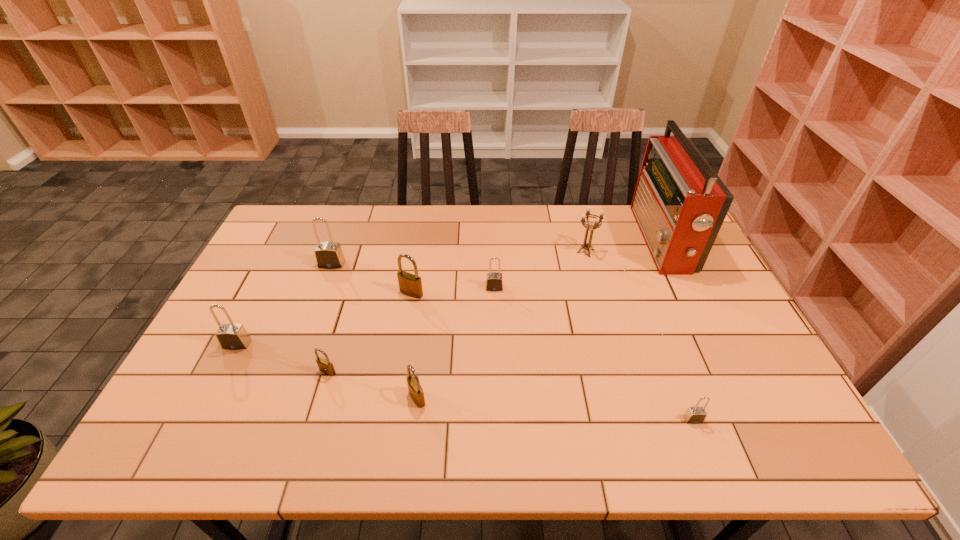
Locate an element on the screen. The width and height of the screenshot is (960, 540). vacant space located 0.230m on the right of the third object from right to left is located at coordinates (666, 251).

This screenshot has height=540, width=960. What are the coordinates of `vacant point located on the right of the biggest brass padlock` in the screenshot? It's located at click(x=467, y=293).

This screenshot has width=960, height=540. Find the location of `free spot located 0.160m on the shackle of the sixth farthest object`. free spot located 0.160m on the shackle of the sixth farthest object is located at coordinates (206, 404).

The image size is (960, 540). In order to click on vacant space located 0.190m on the shackle of the third biggest gray padlock in this screenshot , I will do `click(496, 341)`.

This screenshot has width=960, height=540. Find the location of `vacant region located 0.310m on the left of the nearest brass padlock`. vacant region located 0.310m on the left of the nearest brass padlock is located at coordinates [278, 398].

Where is `vacant space located 0.060m on the shackle of the rightmost gray padlock`? The width and height of the screenshot is (960, 540). vacant space located 0.060m on the shackle of the rightmost gray padlock is located at coordinates (705, 449).

Where is `vacant space located on the right of the seventh object from right to left`? vacant space located on the right of the seventh object from right to left is located at coordinates (356, 372).

Identify the location of radio receiver situated at the far edge. (679, 203).

This screenshot has width=960, height=540. In order to click on candle holder positioned at the far edge in this screenshot , I will do `click(597, 224)`.

Where is `object that is at the near edge`? object that is at the near edge is located at coordinates pos(694,415).